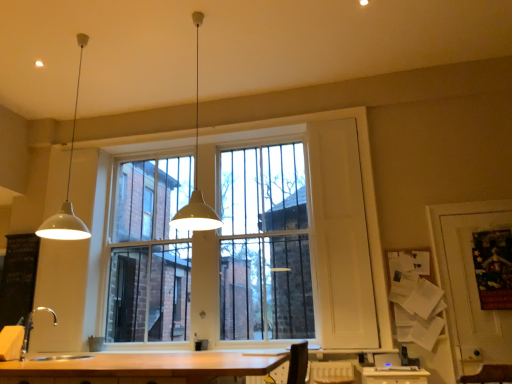
Locate an element on the screen. This screenshot has width=512, height=384. free point above white matte pendant light at upper left, placed as the 2th lamp when sorted from right to left (from a real-world perspective) is located at coordinates (81, 38).